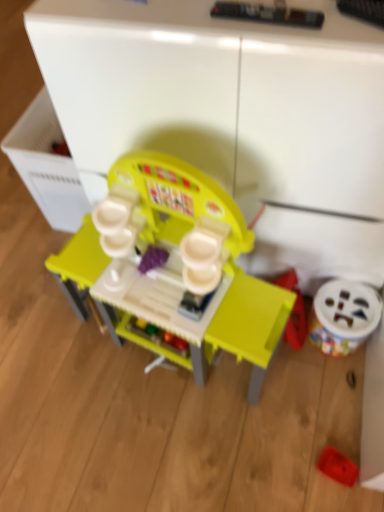
Locate an element on the screen. free space that is to the left of rubberized red tray at lower right, which is the second toy in left-to-right order is located at coordinates tap(281, 462).